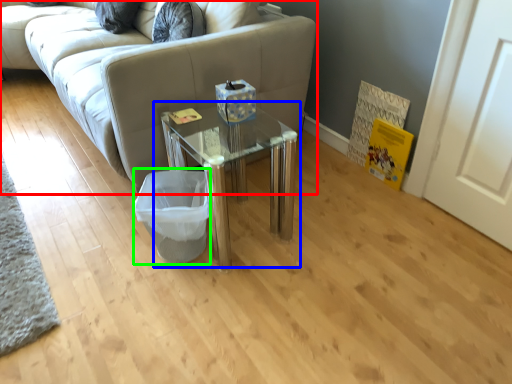
Question: Which object is the closest to the studio couch (highlighted by a red box)? Choose among these: table (highlighted by a blue box) or laundry basket (highlighted by a green box).

Choices:
 (A) table
 (B) laundry basket

Answer: (A)